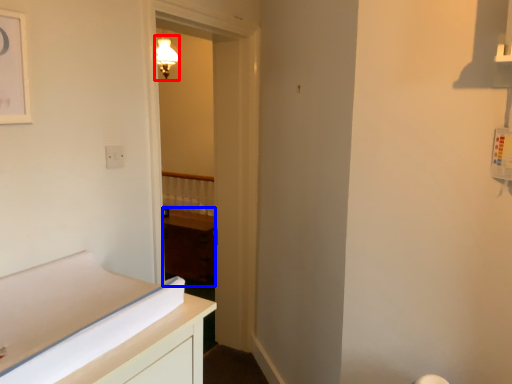
Question: Among these objects, which one is farthest to the camera, light fixture (highlighted by a red box) or cabinetry (highlighted by a blue box)?

Choices:
 (A) light fixture
 (B) cabinetry

Answer: (A)